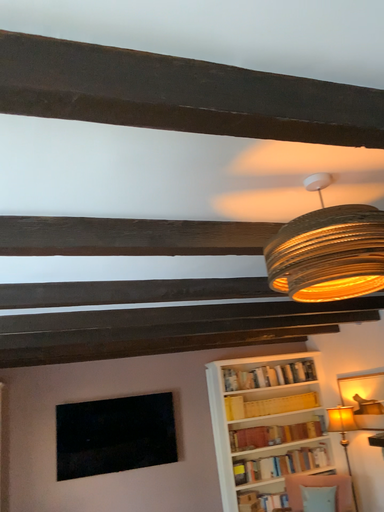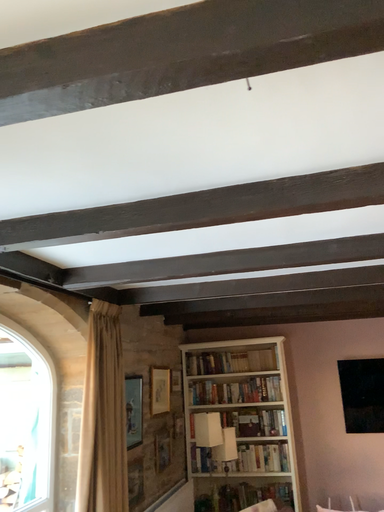
Question: Which way did the camera rotate in the video?

Choices:
 (A) rotated left
 (B) rotated right

Answer: (A)